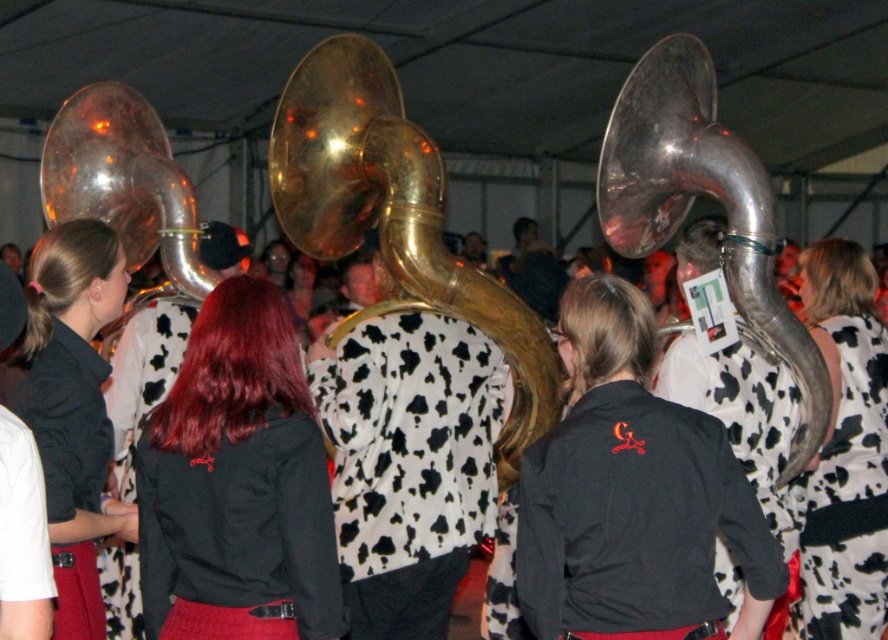
Question: Does shiny brass tuba at left appear under white cow print dress at center?

Choices:
 (A) yes
 (B) no

Answer: (B)

Question: Which point appears farthest from the camera in this image?

Choices:
 (A) (429, 150)
 (B) (284, 380)

Answer: (A)

Question: Which point is farther to the camera?

Choices:
 (A) matte black shirt at center
 (B) cow print dress at center

Answer: (B)

Question: In this image, where is black fabric jacket at center located relative to shiny brass tuba at left?

Choices:
 (A) above
 (B) below

Answer: (B)

Question: Which point is closer to the camera taking this photo?

Choices:
 (A) (362, 433)
 (B) (80, 180)
 (C) (438, 243)
 (D) (680, 244)

Answer: (C)

Question: Does black fabric shirt at center appear over polished silver tuba at center?

Choices:
 (A) yes
 (B) no

Answer: (B)